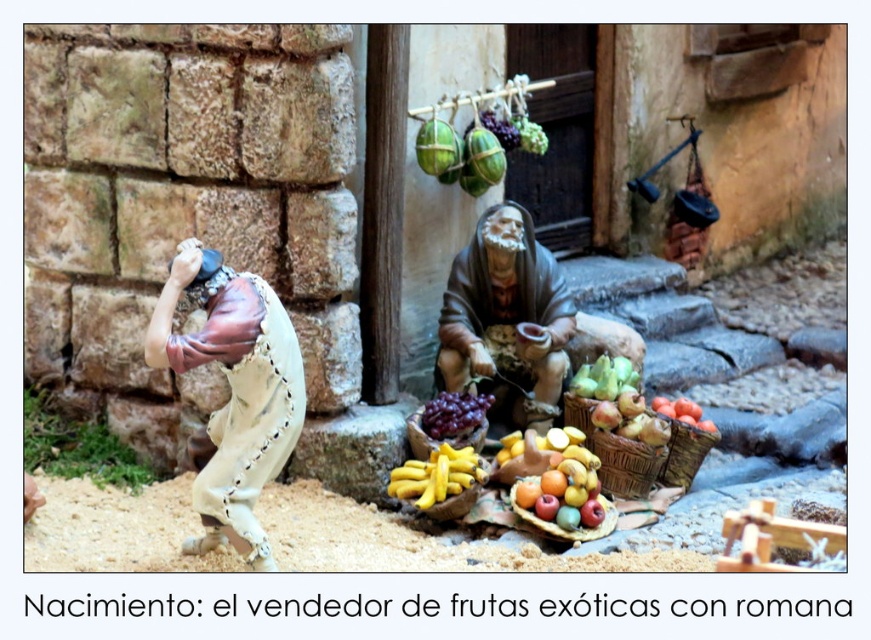
Consider the image. You are organizing a fruit display and need to place the woven brown basket at center and the shiny red tomatoes at lower right. Which object should you place first if you want to ensure there is enough space for both?

You should place the woven brown basket at center first since it is wider than the shiny red tomatoes at lower right, ensuring there is enough space for both.

You are an artist trying to paint the nativity scene. You need to place the green matte apples at center in your painting. According to the coordinates provided, where should you position them on your canvas?

The green matte apples at center should be positioned at coordinates point [604,378] on the canvas.

You are a fruit vendor in the nativity scene. You need to place a new fruit basket that is 10 cm tall on the table. The table has space only where the glossy wooden tray of fruits at center and purple matte grapes at center are located. Can you fit the new basket there without moving the existing items?

The glossy wooden tray of fruits at center is taller than purple matte grapes at center. The new basket is 10 cm tall. Since the existing items are already taller than or equal to 10 cm, the new basket may not fit unless there is vertical space available. However, the description only mentions their relative heights, not the total vertical clearance. Therefore, it is uncertain if the new basket will fit without more information about the table height.